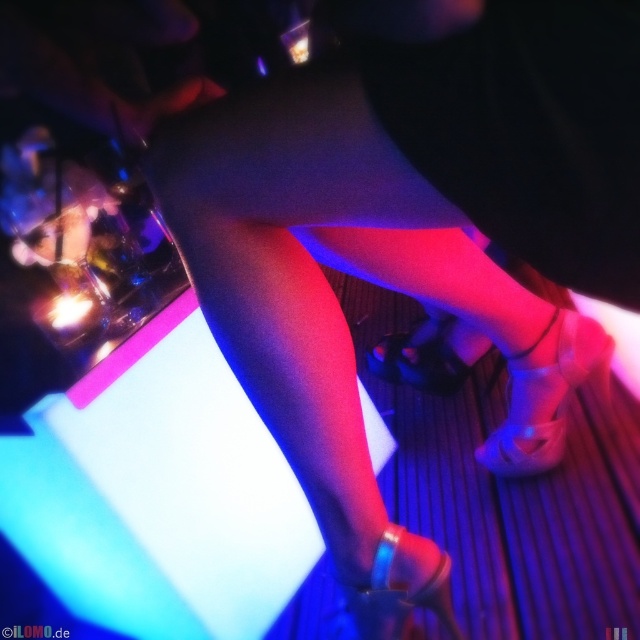
Question: Based on their relative distances, which object is farther from the clear plastic shoe at lower right?

Choices:
 (A) clear plastic ring at lower center
 (B) satin black shoe at center

Answer: (A)

Question: Estimate the real-world distances between objects in this image. Which object is farther from the satin black shoe at center?

Choices:
 (A) clear plastic ring at lower center
 (B) clear plastic shoe at lower right

Answer: (A)

Question: Does clear plastic ring at lower center appear over satin black shoe at center?

Choices:
 (A) yes
 (B) no

Answer: (B)

Question: Which of these objects is positioned closest to the clear plastic shoe at lower right?

Choices:
 (A) clear plastic ring at lower center
 (B) satin black shoe at center

Answer: (B)

Question: Can you confirm if clear plastic ring at lower center is thinner than satin black shoe at center?

Choices:
 (A) no
 (B) yes

Answer: (B)

Question: Does clear plastic shoe at lower right appear on the left side of satin black shoe at center?

Choices:
 (A) yes
 (B) no

Answer: (B)